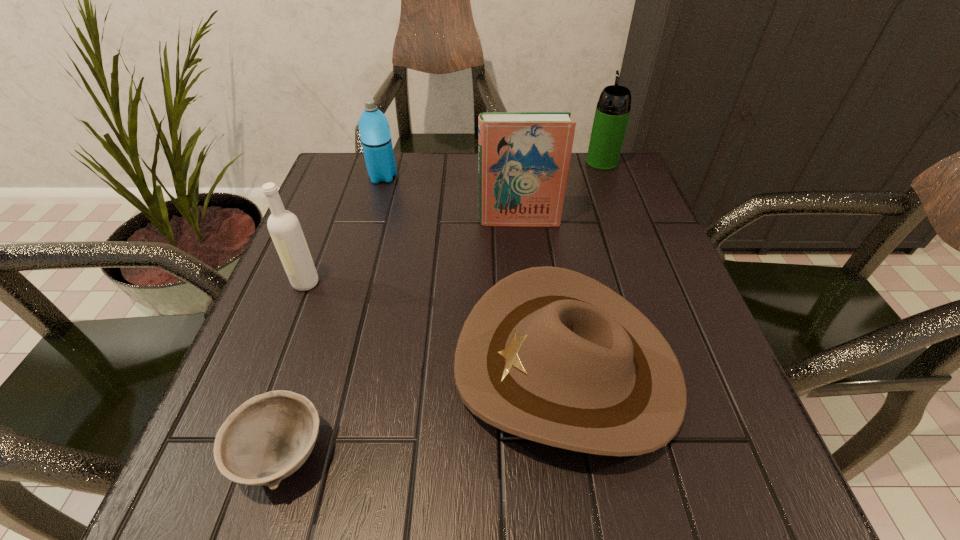
Where is `hardback book`? This screenshot has height=540, width=960. hardback book is located at coordinates (523, 157).

Where is `the right thermos bottle`? Image resolution: width=960 pixels, height=540 pixels. the right thermos bottle is located at coordinates (x=612, y=112).

Where is `vodka`? vodka is located at coordinates (285, 230).

The height and width of the screenshot is (540, 960). What are the coordinates of `the left thermos bottle` in the screenshot? It's located at (375, 135).

Find the location of `cowboy hat`. cowboy hat is located at coordinates (548, 354).

The width and height of the screenshot is (960, 540). In order to click on bowl in this screenshot , I will do `click(270, 436)`.

Image resolution: width=960 pixels, height=540 pixels. Find the location of `blank space located 0.300m on the cover of the hardback book`. blank space located 0.300m on the cover of the hardback book is located at coordinates (530, 333).

The width and height of the screenshot is (960, 540). I want to click on free spot located on the front of the vodka, so click(273, 368).

Identify the location of vacant space located on the left of the left thermos bottle. (338, 177).

Image resolution: width=960 pixels, height=540 pixels. Identify the location of vacant space located with a star on the front of the fifth tallest object. (346, 367).